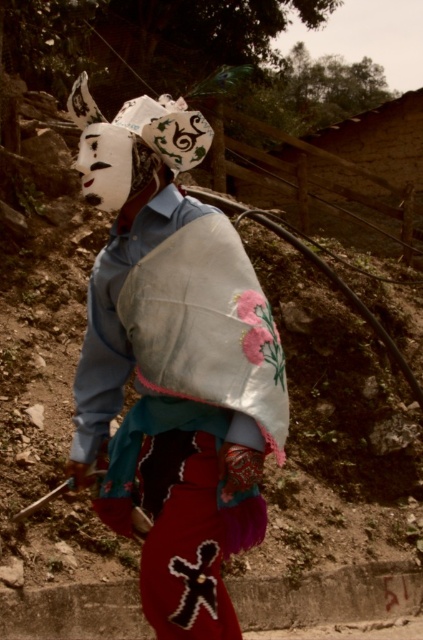
You are an artist observing the scene and want to paint the masks accurately. Which of the two masks, the white matte mask at upper left or the white fabric mask at upper center, should you depict as taller in your painting?

The white matte mask at upper left has a greater height compared to the white fabric mask at upper center, so you should depict the white matte mask at upper left as taller in your painting.

From the picture: You are standing in front of the person in the image. Which of the two points, point (120, 321) or point (109, 150), is closer to you?

Point (109, 150) is closer to you because it is in front of point (120, 321).

You are an artist trying to create a replica of the masks in the image. You have two masks to reference. Which mask has a wider width, the white matte mask at upper left or the white fabric mask at upper center?

The white matte mask at upper left might be wider than white fabric mask at upper center according to the description.